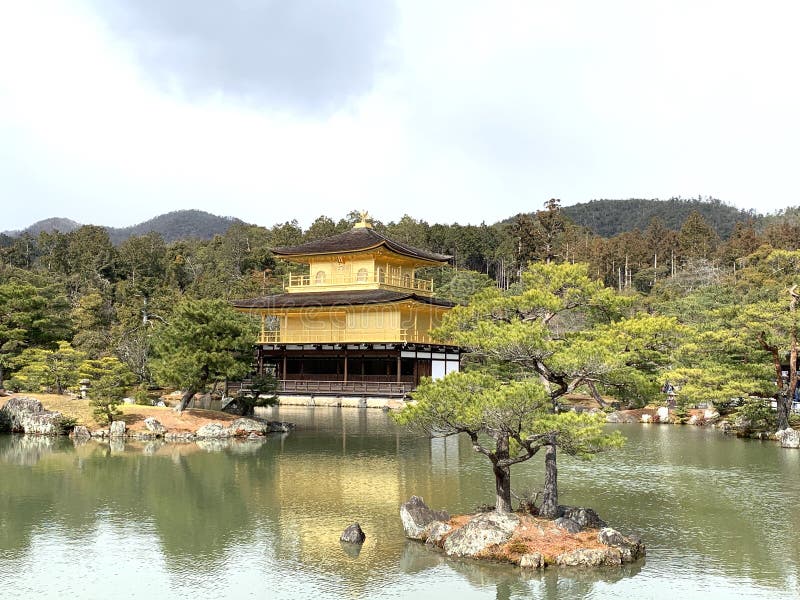
Identify the location of corner. The image size is (800, 600). (413, 290), (450, 251), (380, 237), (270, 249), (230, 301), (405, 341).